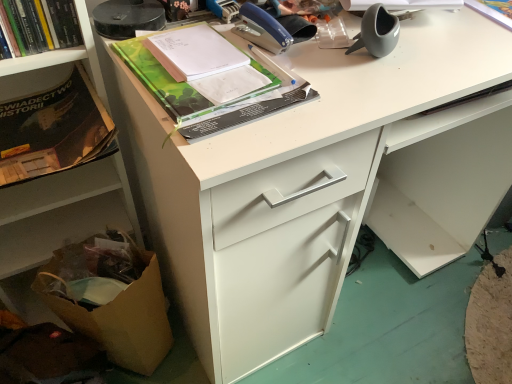
Locate an element on the screen. The height and width of the screenshot is (384, 512). vacant space that is to the left of white paper at upper right, which appears as the third book when viewed from the left is located at coordinates (462, 38).